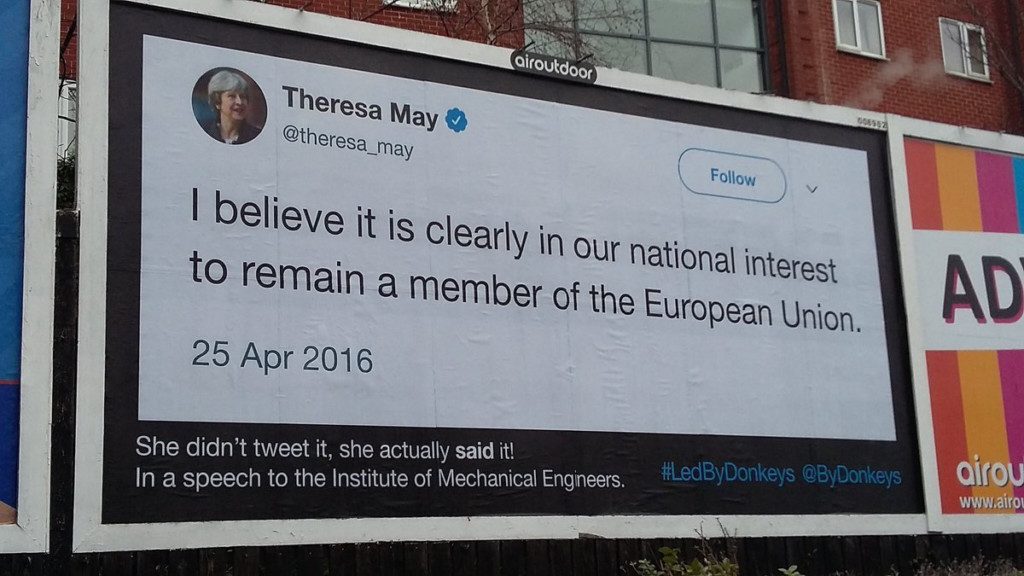
At what (x,y) coordinates should I click in order to perform the action: click on large window. Please return your answer as a coordinate pair (x, y). The width and height of the screenshot is (1024, 576). Looking at the image, I should click on (703, 59).